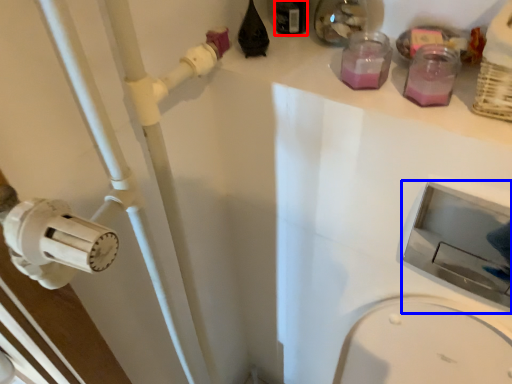
Question: Which object is further to the camera taking this photo, bottle (highlighted by a red box) or sink (highlighted by a blue box)?

Choices:
 (A) bottle
 (B) sink

Answer: (A)